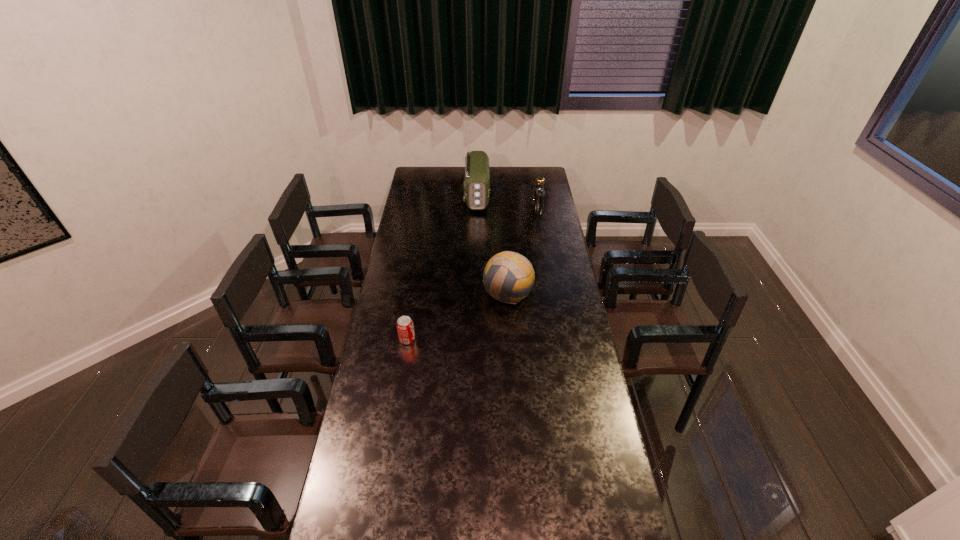
What are the coordinates of `blank region between the radio_receiver and the volleyball` in the screenshot? It's located at (492, 245).

At what (x,y) coordinates should I click in order to perform the action: click on free space between the vodka and the third farthest object. Please return your answer as a coordinate pair (x, y). The height and width of the screenshot is (540, 960). Looking at the image, I should click on (522, 252).

What are the coordinates of `vacant space that is in between the volleyball and the nearest object` in the screenshot? It's located at (458, 316).

Locate an element on the screen. This screenshot has height=540, width=960. free space between the volleyball and the leftmost object is located at coordinates (458, 316).

The height and width of the screenshot is (540, 960). Identify the location of vacant point located between the volleyball and the rightmost object. (522, 252).

At what (x,y) coordinates should I click in order to perform the action: click on free point between the soda and the volleyball. Please return your answer as a coordinate pair (x, y). Looking at the image, I should click on (458, 316).

Where is `vacant space that is in between the radio_receiver and the volleyball`? This screenshot has width=960, height=540. vacant space that is in between the radio_receiver and the volleyball is located at coordinates (492, 245).

I want to click on the third closest object to the third farthest object, so click(477, 177).

Identify the location of object that is the second closest to the radio_receiver. The image size is (960, 540). (508, 277).

Locate an element on the screen. free spot that satisfies the following two spatial constraints: 1. on the front-facing side of the vodka; 2. on the front side of the volleyball is located at coordinates (552, 293).